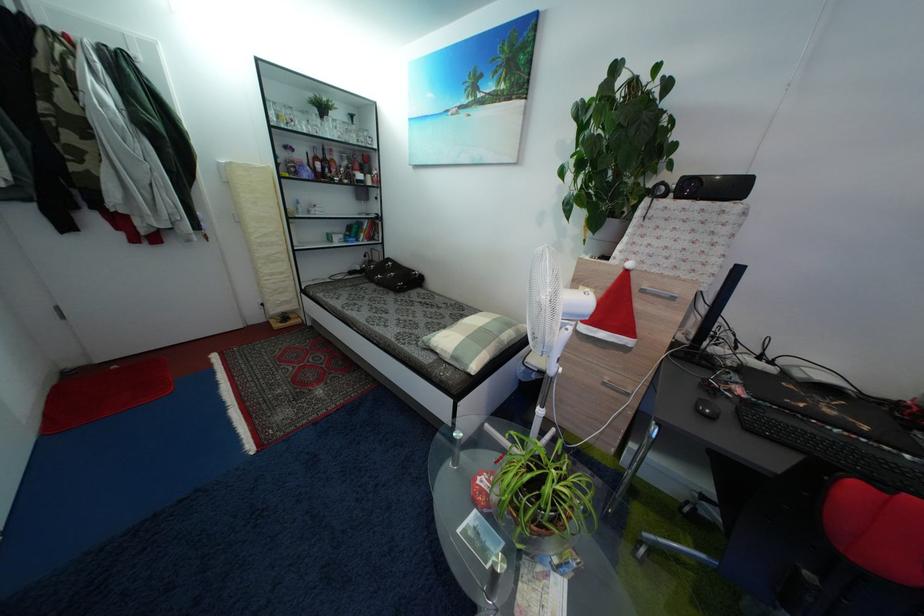
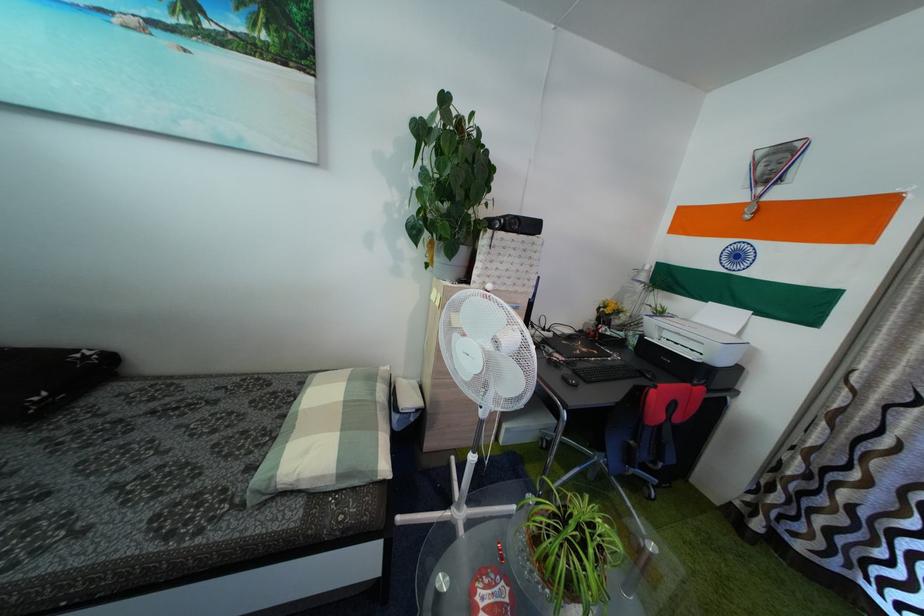
Question: The first image is from the beginning of the video and the second image is from the end. How did the camera likely rotate when shooting the video?

Choices:
 (A) Left
 (B) Right
 (C) Up
 (D) Down

Answer: (B)